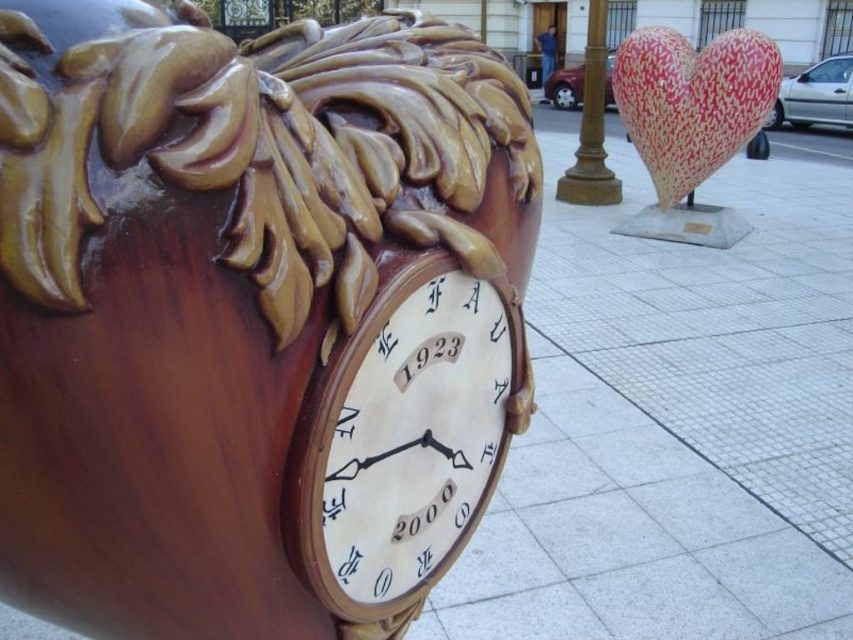
Question: Does white tile pavement at center have a lesser width compared to gold metallic pole at center?

Choices:
 (A) no
 (B) yes

Answer: (B)

Question: Which point appears farthest from the camera in this image?

Choices:
 (A) (596, 196)
 (B) (265, 364)

Answer: (A)

Question: Is polished wood clock at center positioned at the back of gold metallic pole at center?

Choices:
 (A) no
 (B) yes

Answer: (A)

Question: From the image, what is the correct spatial relationship of polished wood clock at center in relation to white tile pavement at center?

Choices:
 (A) left
 (B) right

Answer: (A)

Question: Among these objects, which one is nearest to the camera?

Choices:
 (A) red textured heart at upper right
 (B) gold metallic pole at center
 (C) matte brown clock at center

Answer: (C)

Question: Which point is farther to the camera?

Choices:
 (A) (584, 61)
 (B) (810, 605)
 (C) (483, 388)
 (D) (628, 122)

Answer: (A)